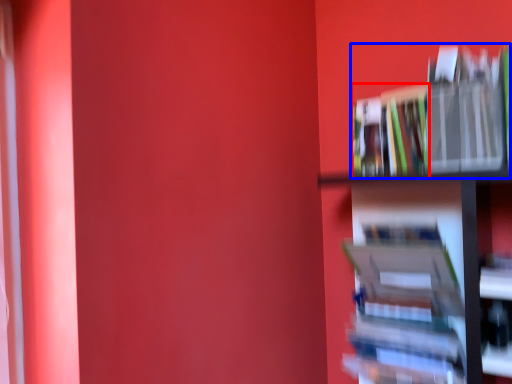
Question: Which point is further to the camera, book (highlighted by a red box) or book (highlighted by a blue box)?

Choices:
 (A) book
 (B) book

Answer: (A)